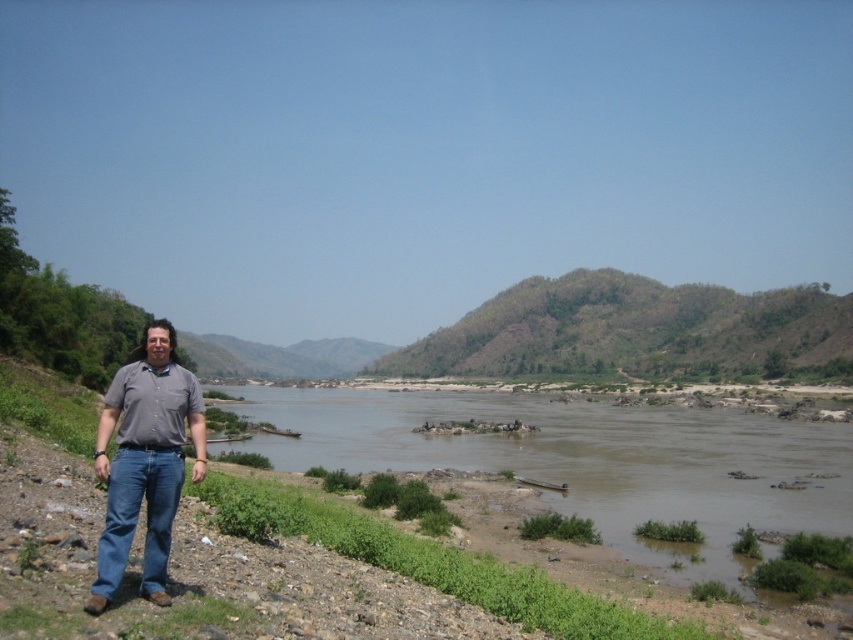
Between point (703, 500) and point (158, 344), which one is positioned behind?

The point (703, 500) is behind.

Is brown muddy water at center smaller than denim jeans at left?

No, brown muddy water at center is not smaller than denim jeans at left.

Does point (799, 420) come farther from viewer compared to point (107, 541)?

Yes, point (799, 420) is farther from viewer.

This screenshot has width=853, height=640. What are the coordinates of `brown muddy water at center` in the screenshot? It's located at (585, 460).